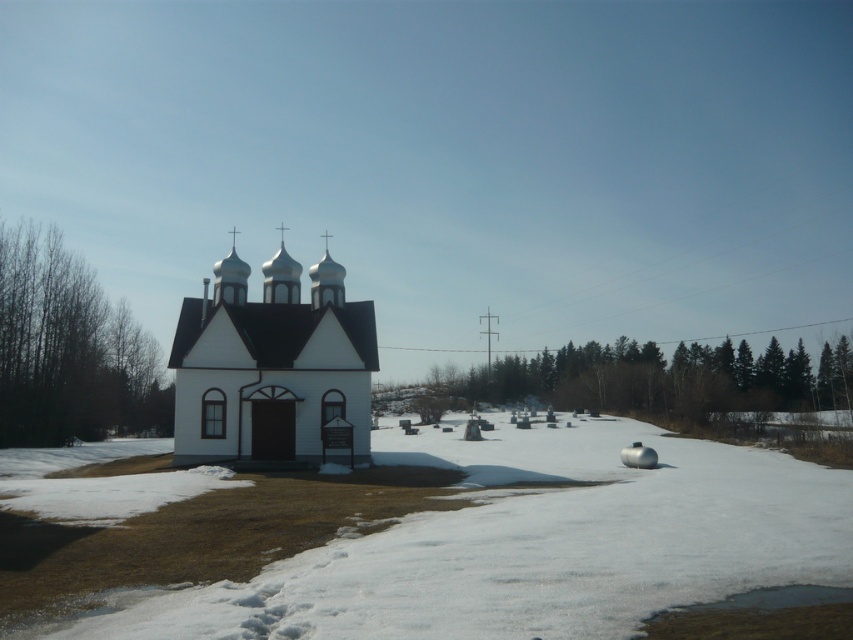
You are a photographer planning to capture the white matte church at center and the white metallic dome at center in a single shot. Based on their heights, which object should you position closer to the camera to ensure both are fully visible in the frame?

The white matte church at center is not as tall as the white metallic dome at center, so you should position the white metallic dome at center closer to the camera to ensure both are fully visible in the frame.

You are an architect evaluating the proportions of the white matte church at center and the white metallic dome at center. Which object has a greater width?

The white metallic dome at center has a greater width than the white matte church at center according to the description.

You are standing at the center of the church and want to walk to the white powdery snow at lower center. In which direction should you walk?

The white powdery snow at lower center is located at point (x=532, y=545), which is towards the lower center direction from the church. Therefore, you should walk towards the lower center direction to reach it.